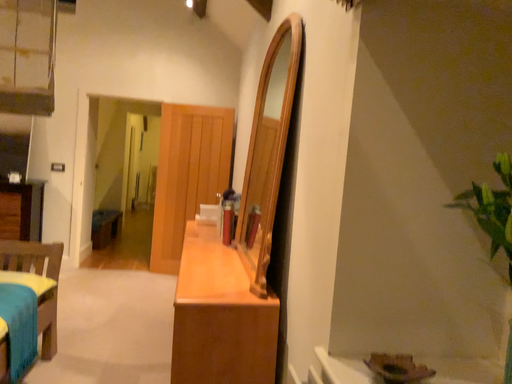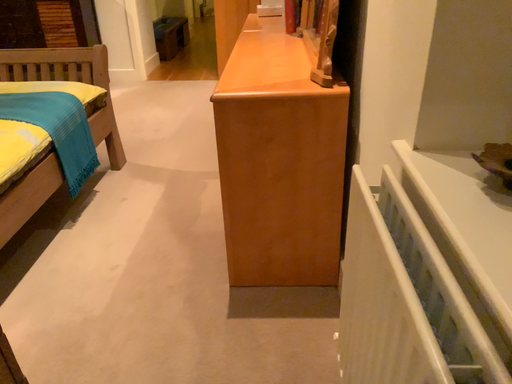
Question: Which way did the camera rotate in the video?

Choices:
 (A) rotated left
 (B) rotated right

Answer: (A)